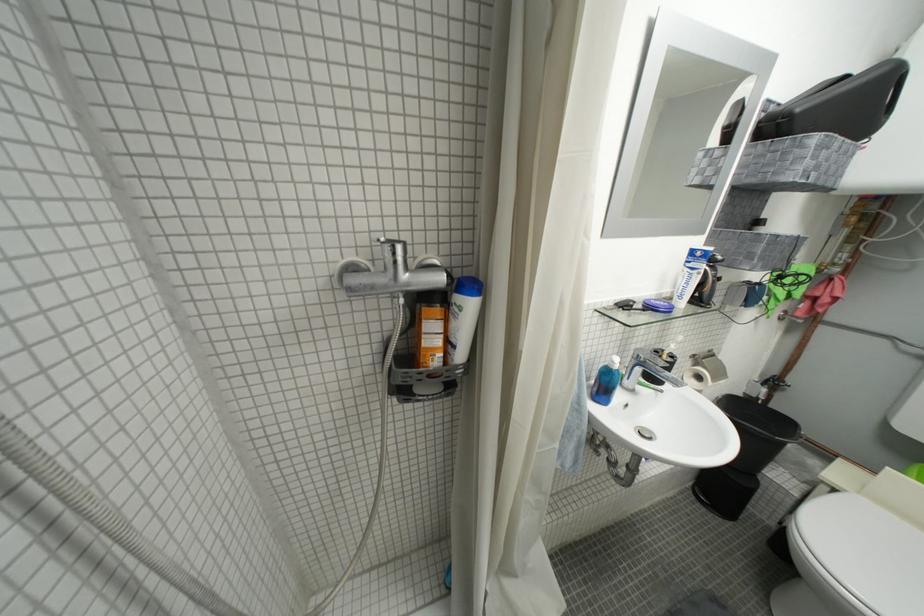
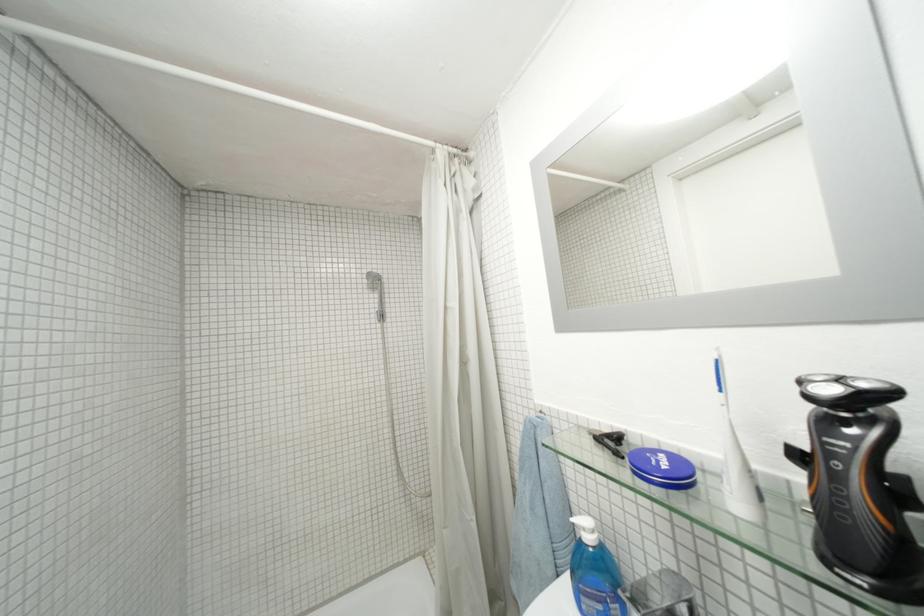
Locate, in the second image, the point that corresponds to point (626, 369) in the first image.

(598, 541)